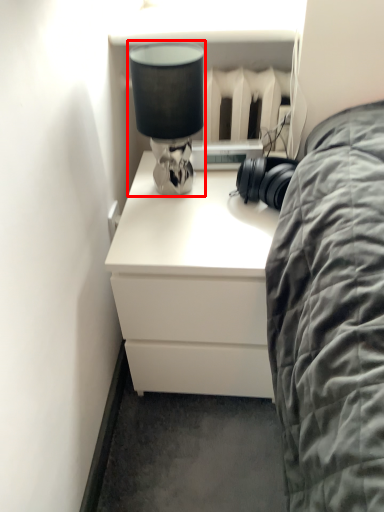
Question: Observing the image, what is the correct spatial positioning of table lamp (annotated by the red box) in reference to chest of drawers?

Choices:
 (A) left
 (B) right

Answer: (A)